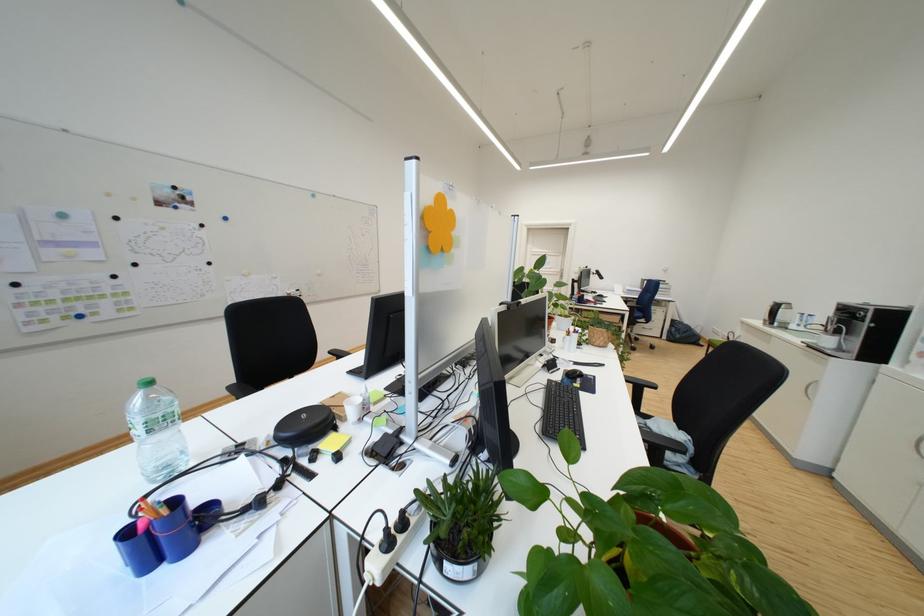
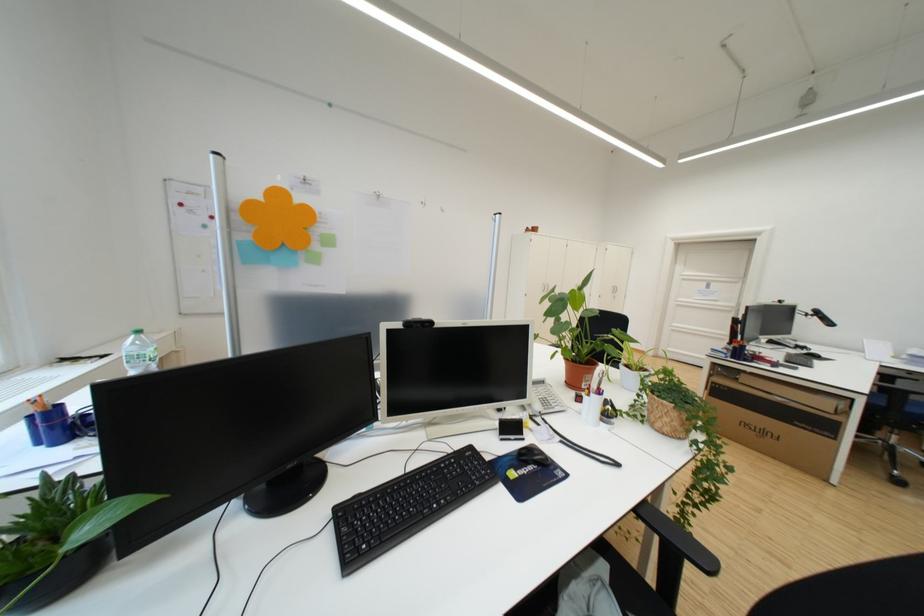
Question: I am providing you with two images of the same scene from different viewpoints. Please identify which objects are invisible in image2.

Choices:
 (A) terracotta plant pot
 (B) black computer mouse
 (C) metal door handle
 (D) none of these

Answer: (D)